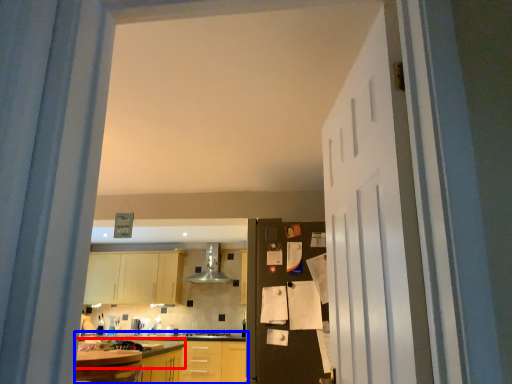
Question: Which of the following is the farthest to the observer, countertop (highlighted by a red box) or countertop (highlighted by a blue box)?

Choices:
 (A) countertop
 (B) countertop

Answer: (B)